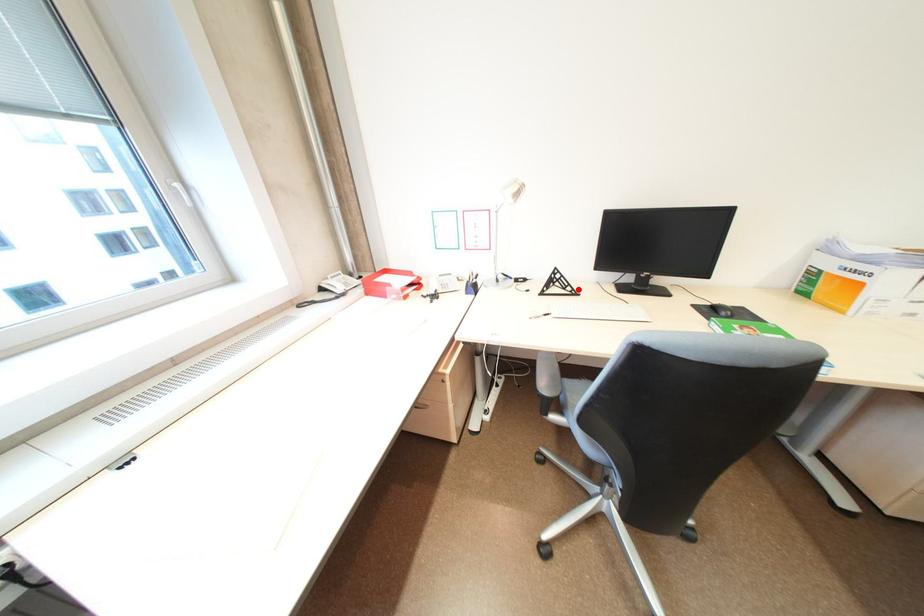
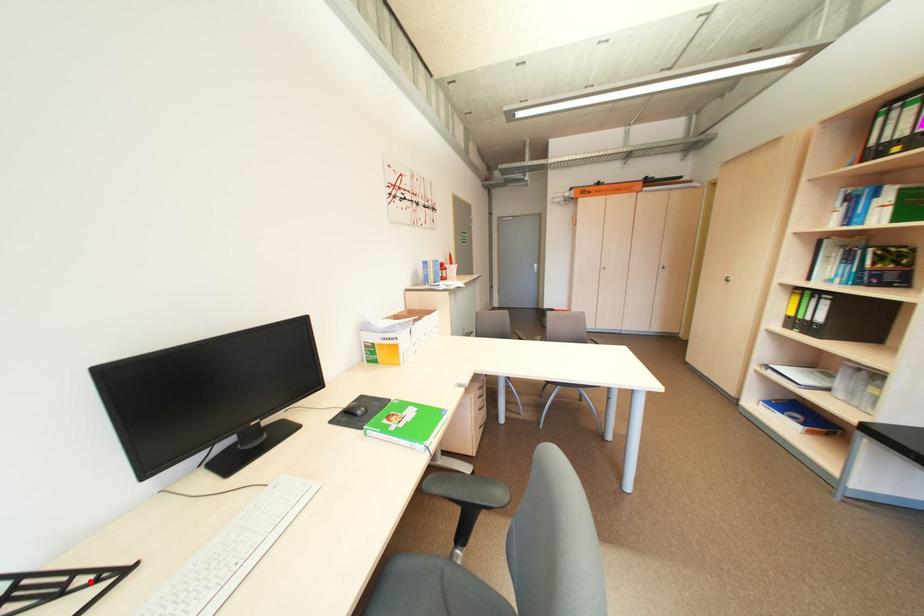
I am providing you with two images of the same scene from different viewpoints. A red point is marked on the first image and another point is marked on the second image. Do the highlighted points in image1 and image2 indicate the same real-world spot?

Yes